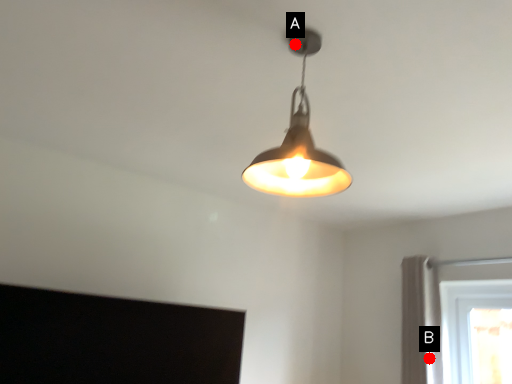
Question: Two points are circled on the image, labeled by A and B beside each circle. Which of the following is the closest to the observer?

Choices:
 (A) A is closer
 (B) B is closer

Answer: (A)